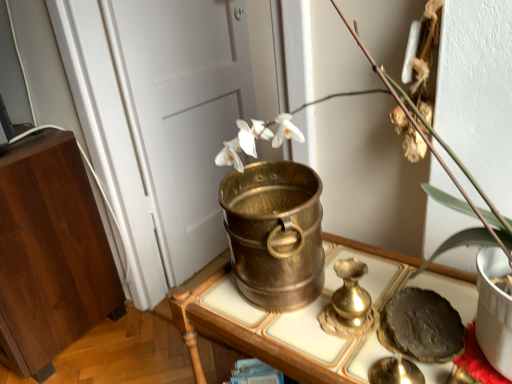
Question: Is shiny dark plate at lower right positioned in front of white porcelain vase at center?

Choices:
 (A) yes
 (B) no

Answer: (B)

Question: Does shiny dark plate at lower right have a greater width compared to white porcelain vase at center?

Choices:
 (A) yes
 (B) no

Answer: (B)

Question: Considering the relative sizes of shiny dark plate at lower right and white porcelain vase at center in the image provided, is shiny dark plate at lower right taller than white porcelain vase at center?

Choices:
 (A) yes
 (B) no

Answer: (B)

Question: Considering the relative positions of shiny dark plate at lower right and white porcelain vase at center in the image provided, is shiny dark plate at lower right behind white porcelain vase at center?

Choices:
 (A) yes
 (B) no

Answer: (A)

Question: Can you confirm if shiny dark plate at lower right is thinner than white porcelain vase at center?

Choices:
 (A) yes
 (B) no

Answer: (A)

Question: From the image's perspective, is white matte door at center positioned above or below shiny dark plate at lower right?

Choices:
 (A) below
 (B) above

Answer: (B)

Question: Relative to shiny dark plate at lower right, is white matte door at center in front or behind?

Choices:
 (A) front
 (B) behind

Answer: (B)

Question: Considering the positions of point (166, 142) and point (411, 337), is point (166, 142) closer or farther from the camera than point (411, 337)?

Choices:
 (A) farther
 (B) closer

Answer: (A)

Question: Considering the positions of white matte door at center and shiny dark plate at lower right in the image, is white matte door at center wider or thinner than shiny dark plate at lower right?

Choices:
 (A) wide
 (B) thin

Answer: (B)

Question: Is point (424, 299) positioned closer to the camera than point (86, 253)?

Choices:
 (A) farther
 (B) closer

Answer: (B)

Question: Is shiny dark plate at lower right taller or shorter than wooden cabinet at left, the 1th furniture from the left?

Choices:
 (A) tall
 (B) short

Answer: (B)

Question: Is shiny dark plate at lower right wider or thinner than wooden cabinet at left, the 1th furniture from the left?

Choices:
 (A) thin
 (B) wide

Answer: (A)

Question: From the image's perspective, is shiny dark plate at lower right above or below wooden cabinet at left, the first furniture when ordered from back to front?

Choices:
 (A) below
 (B) above

Answer: (A)

Question: From a real-world perspective, is brass bucket at center, marked as the 2th furniture in a back-to-front arrangement, physically located above or below white matte door at center?

Choices:
 (A) above
 (B) below

Answer: (B)

Question: Would you say brass bucket at center, marked as the 2th furniture in a back-to-front arrangement, is inside or outside white matte door at center?

Choices:
 (A) inside
 (B) outside

Answer: (B)